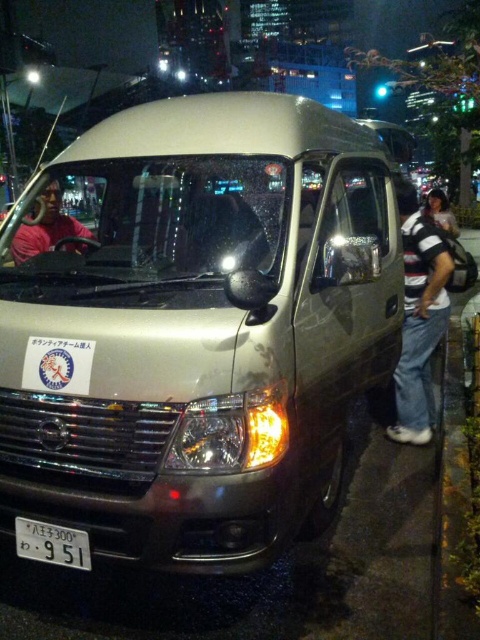
Is striped cotton shirt at right positioned at the back of black plastic license plate at lower center?

Yes.

Identify the location of striped cotton shirt at right. The width and height of the screenshot is (480, 640). (419, 316).

Can you confirm if transparent glass windshield at center is bigger than pink matte shirt at driver's seat?

Indeed, transparent glass windshield at center has a larger size compared to pink matte shirt at driver's seat.

Between transparent glass windshield at center and pink matte shirt at driver's seat, which one appears on the left side from the viewer's perspective?

pink matte shirt at driver's seat

Is point (88, 202) in front of point (45, 212)?

Yes, point (88, 202) is in front of point (45, 212).

Where is `transparent glass windshield at center`? The image size is (480, 640). transparent glass windshield at center is located at coordinates (152, 221).

Does pink matte shirt at driver's seat have a greater width compared to black plastic license plate at lower center?

Yes, pink matte shirt at driver's seat is wider than black plastic license plate at lower center.

Is point (34, 211) positioned before point (28, 554)?

No.

Where is `pink matte shirt at driver's seat`? pink matte shirt at driver's seat is located at coordinates tap(46, 225).